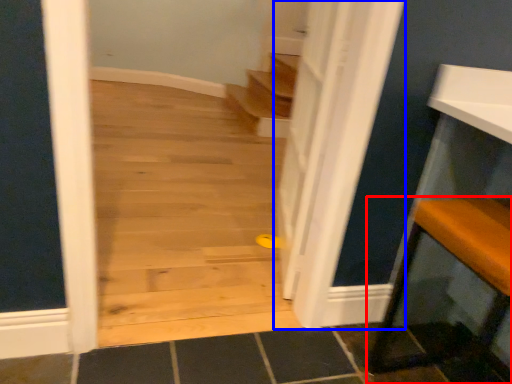
Question: Among these objects, which one is farthest to the camera, furniture (highlighted by a red box) or door (highlighted by a blue box)?

Choices:
 (A) furniture
 (B) door

Answer: (B)